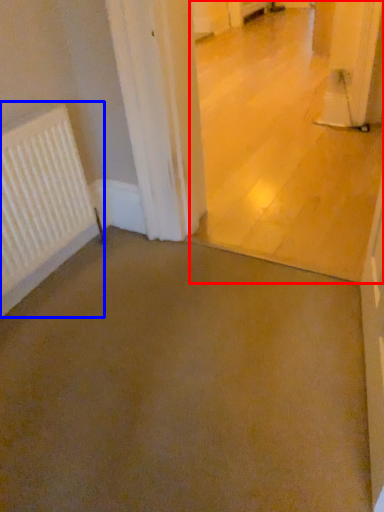
Question: Which point is further to the camera, concrete (highlighted by a red box) or radiator (highlighted by a blue box)?

Choices:
 (A) concrete
 (B) radiator

Answer: (B)